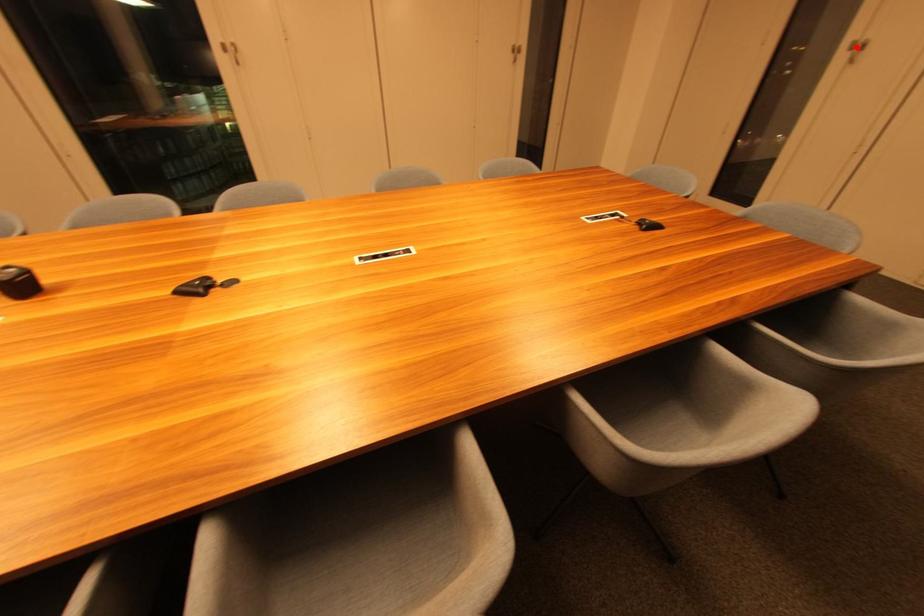
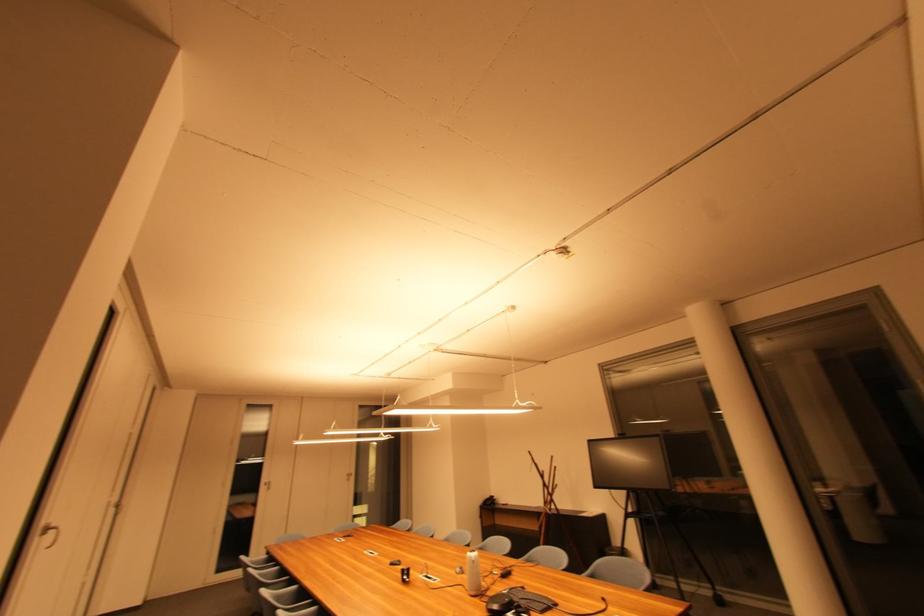
Question: I am providing you with two images of the same scene from different viewpoints. A red point is shown in image1. For the corresponding object point in image2, is it positioned nearer or farther from the camera?

Choices:
 (A) Nearer
 (B) Farther

Answer: (A)